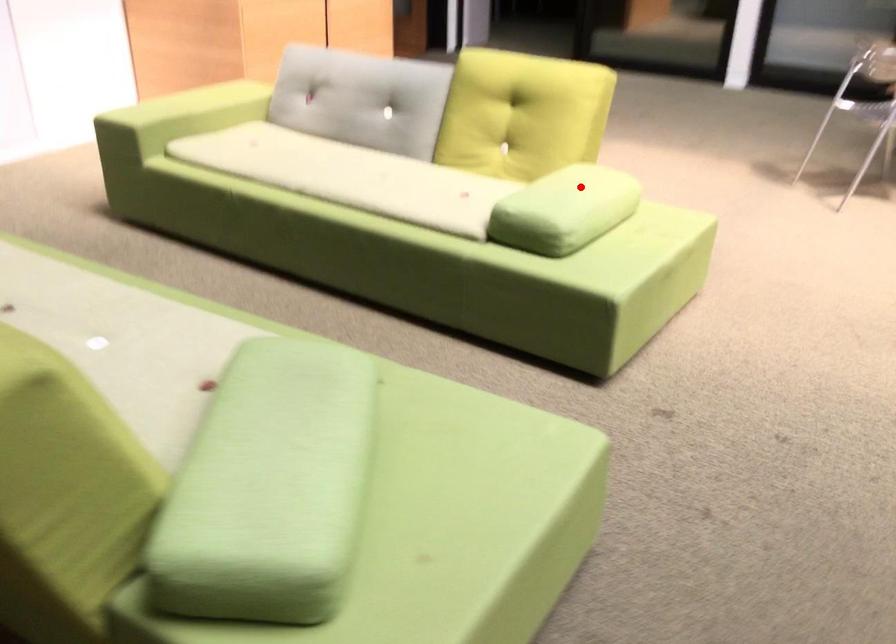
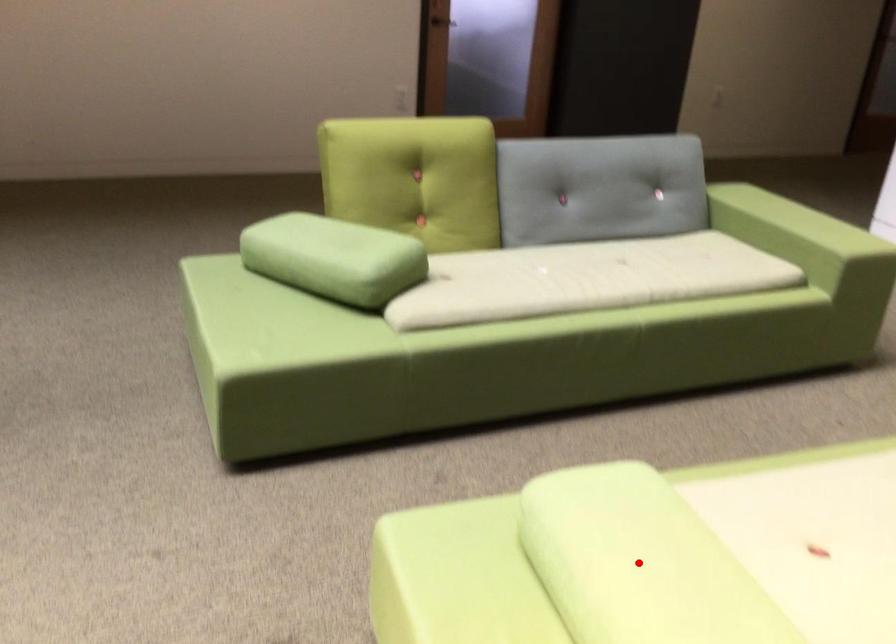
I am providing you with two images of the same scene from different viewpoints. A red point is marked on the first image and another point is marked on the second image. Is the marked point in image1 the same physical position as the marked point in image2?

Yes